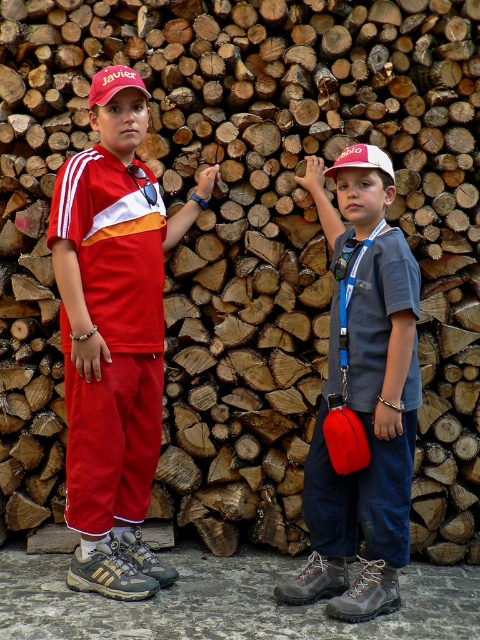
Can you confirm if matte red baseball cap at upper left is positioned to the left of white fabric baseball cap at upper center?

Indeed, matte red baseball cap at upper left is positioned on the left side of white fabric baseball cap at upper center.

Can you confirm if matte red baseball cap at upper left is positioned to the right of white fabric baseball cap at upper center?

Incorrect, matte red baseball cap at upper left is not on the right side of white fabric baseball cap at upper center.

What are the coordinates of `matte red baseball cap at upper left` in the screenshot? It's located at (113, 83).

Can you confirm if matte red tracksuit at left is bigger than matte red baseball cap at upper left?

Yes.

What do you see at coordinates (113, 342) in the screenshot? Image resolution: width=480 pixels, height=640 pixels. I see `matte red tracksuit at left` at bounding box center [113, 342].

Locate an element on the screen. matte red tracksuit at left is located at coordinates (113, 342).

What do you see at coordinates (113, 342) in the screenshot? I see `matte red tracksuit at left` at bounding box center [113, 342].

Who is more forward, (x=126, y=348) or (x=362, y=161)?

Positioned in front is point (x=362, y=161).

You are a GUI agent. You are given a task and a screenshot of the screen. Output one action in this format:
    pyautogui.click(x=<x>, y=<y>)
    Task: Click on the matte red tracksuit at left
    The height and width of the screenshot is (640, 480).
    Given the screenshot: What is the action you would take?
    pyautogui.click(x=113, y=342)